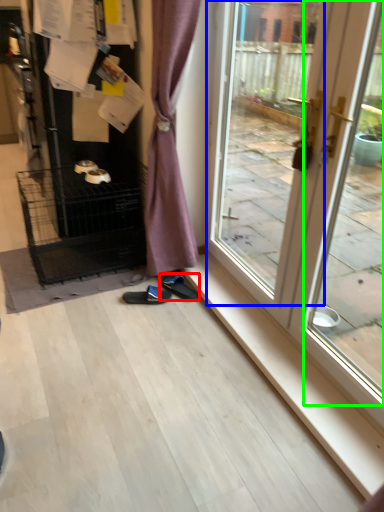
Question: Which object is the farthest from footwear (highlighted by a red box)? Choose among these: window (highlighted by a blue box) or screen door (highlighted by a green box).

Choices:
 (A) window
 (B) screen door

Answer: (B)